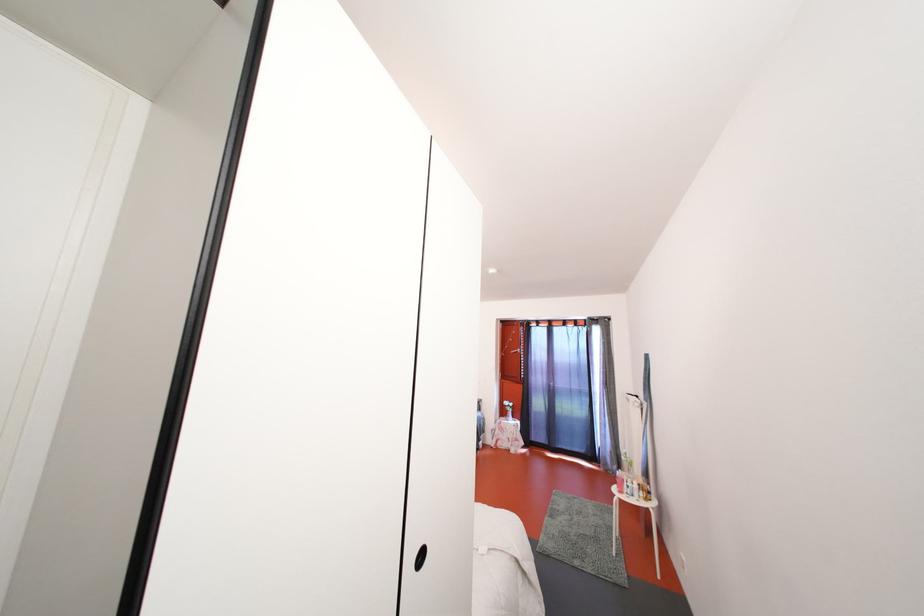
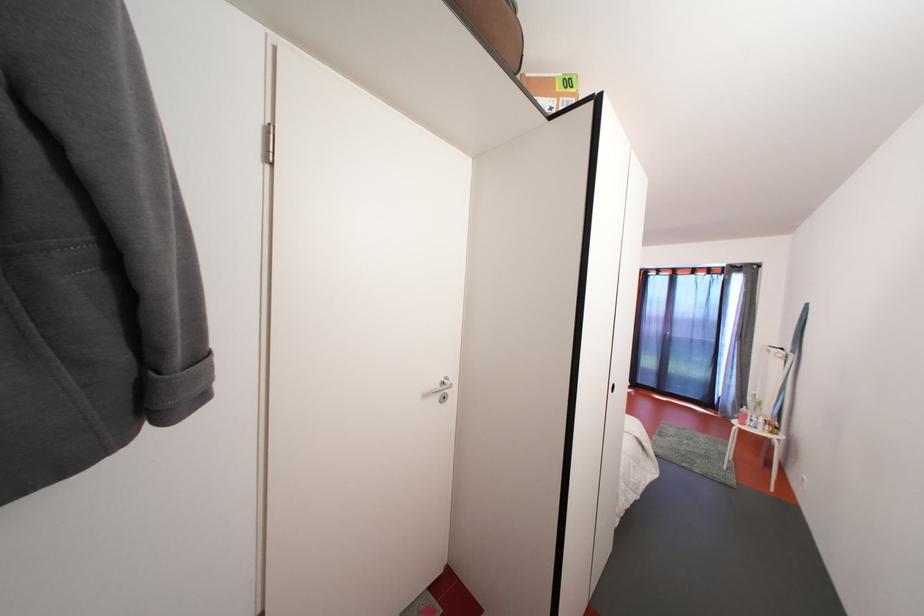
In the second image, find the point that corresponds to point 630,464 in the first image.

(758, 403)